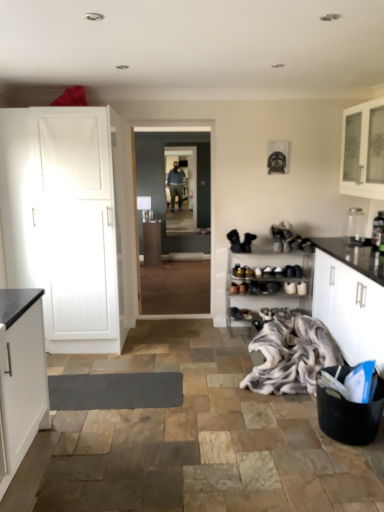
The height and width of the screenshot is (512, 384). Describe the element at coordinates (354, 227) in the screenshot. I see `clear glass jar at upper right, which is the 2th appliance from front to back` at that location.

The height and width of the screenshot is (512, 384). What are the coordinates of `clear glass jar at upper right, the 1th appliance from the back` in the screenshot? It's located at (354, 227).

Identify the location of fluffy white blanket at lower right. This screenshot has width=384, height=512. (291, 355).

The width and height of the screenshot is (384, 512). I want to click on black matte boot at center, the first footwear positioned from the top, so click(235, 241).

The height and width of the screenshot is (512, 384). What do you see at coordinates (363, 150) in the screenshot?
I see `white glass cabinet at upper right, which is counted as the 2th cabinetry, starting from the back` at bounding box center [363, 150].

Identify the location of wooden shoe rack at center. (266, 281).

This screenshot has width=384, height=512. Find the location of `clear glass jar at upper right, the 1th appliance from the back`. clear glass jar at upper right, the 1th appliance from the back is located at coordinates (354, 227).

Which is less distant, (350,135) or (149,245)?

The point (350,135) is in front.

Is white glass cabinet at upper right, which ranks as the first cabinetry in right-to-left order, to the right of matte wood cabinet at center, marked as the 1th cabinetry in a back-to-front arrangement, from the viewer's perspective?

Indeed, white glass cabinet at upper right, which ranks as the first cabinetry in right-to-left order, is positioned on the right side of matte wood cabinet at center, marked as the 1th cabinetry in a back-to-front arrangement.

Considering the relative positions of white glass cabinet at upper right, which is counted as the 2th cabinetry, starting from the back, and matte wood cabinet at center, which appears as the second cabinetry when viewed from the top, in the image provided, is white glass cabinet at upper right, which is counted as the 2th cabinetry, starting from the back, behind matte wood cabinet at center, which appears as the second cabinetry when viewed from the top,?

No, it is not.

Is white glass cabinet at upper right, marked as the 3th cabinetry in a bottom-to-top arrangement, turned away from matte wood cabinet at center, marked as the 1th cabinetry in a back-to-front arrangement?

No, matte wood cabinet at center, marked as the 1th cabinetry in a back-to-front arrangement, is not at the back of white glass cabinet at upper right, marked as the 3th cabinetry in a bottom-to-top arrangement.

Between point (247, 243) and point (196, 227), which one is positioned in front?

Point (247, 243)

Is black suede shoes at center, which ranks as the 2th footwear in top-to-bottom order, not within transparent glass door at center?

Absolutely, black suede shoes at center, which ranks as the 2th footwear in top-to-bottom order, is external to transparent glass door at center.

What are the coordinates of `footwear that is the 2nd one below the transparent glass door at center (from a real-world perspective)` in the screenshot? It's located at (247, 242).

How many degrees apart are the facing directions of black suede shoes at center, which ranks as the 2th footwear in top-to-bottom order, and transparent glass door at center?

0.218 degrees.

Is clear glass jar at upper right, the 1th appliance from the back, facing away from wooden shoe rack at center?

That's not correct — clear glass jar at upper right, the 1th appliance from the back, is not looking away from wooden shoe rack at center.

Considering the relative sizes of clear glass jar at upper right, which is the 2th appliance from front to back, and wooden shoe rack at center in the image provided, is clear glass jar at upper right, which is the 2th appliance from front to back, taller than wooden shoe rack at center?

Incorrect, the height of clear glass jar at upper right, which is the 2th appliance from front to back, is not larger of that of wooden shoe rack at center.

From the picture: How different are the orientations of clear glass jar at upper right, which is the 2th appliance from front to back, and wooden shoe rack at center in degrees?

They differ by 90.3 degrees in their facing directions.

This screenshot has width=384, height=512. I want to click on shelf behind the black woven basket at lower right, so click(266, 281).

Which is in front, point (335, 409) or point (255, 292)?

Positioned in front is point (335, 409).

Is black woven basket at lower right turned away from wooden shoe rack at center?

black woven basket at lower right is not turned away from wooden shoe rack at center.

From the image's perspective, is wooden shoe rack at center over matte wood cabinet at center, the 3th cabinetry viewed from the right?

No, from the image's perspective, wooden shoe rack at center is not on top of matte wood cabinet at center, the 3th cabinetry viewed from the right.

From a real-world perspective, who is located lower, wooden shoe rack at center or matte wood cabinet at center, the 3th cabinetry viewed from the right?

From a 3D spatial view, matte wood cabinet at center, the 3th cabinetry viewed from the right, is below.

Is wooden shoe rack at center positioned behind matte wood cabinet at center, marked as the 1th cabinetry in a back-to-front arrangement?

No, wooden shoe rack at center is closer to the viewer.

Which object is positioned more to the left, wooden shoe rack at center or matte wood cabinet at center, positioned as the 1th cabinetry in left-to-right order?

Positioned to the left is matte wood cabinet at center, positioned as the 1th cabinetry in left-to-right order.

Is black matte boot at center, the first footwear positioned from the top, not within black matte cabinet at right, which appears as the second cabinetry when viewed from the left?

Yes, black matte boot at center, the first footwear positioned from the top, is not within black matte cabinet at right, which appears as the second cabinetry when viewed from the left.

Considering the positions of objects black matte boot at center, the third footwear in the bottom-to-top sequence, and black matte cabinet at right, acting as the third cabinetry starting from the back, in the image provided, who is more to the left, black matte boot at center, the third footwear in the bottom-to-top sequence, or black matte cabinet at right, acting as the third cabinetry starting from the back,?

From the viewer's perspective, black matte boot at center, the third footwear in the bottom-to-top sequence, appears more on the left side.

Considering the sizes of objects black matte boot at center, the third footwear in the bottom-to-top sequence, and black matte cabinet at right, the 1th cabinetry viewed from the front, in the image provided, who is thinner, black matte boot at center, the third footwear in the bottom-to-top sequence, or black matte cabinet at right, the 1th cabinetry viewed from the front,?

black matte boot at center, the third footwear in the bottom-to-top sequence.

From a real-world perspective, who is located lower, black matte boot at center, the first footwear positioned from the top, or black matte cabinet at right, placed as the second cabinetry when sorted from right to left?

black matte cabinet at right, placed as the second cabinetry when sorted from right to left, from a real-world perspective.

Considering the points (259, 388) and (250, 267), which point is in front, point (259, 388) or point (250, 267)?

Positioned in front is point (259, 388).

Is fluffy white blanket at lower right wider or thinner than wooden shoe rack at center?

Considering their sizes, fluffy white blanket at lower right looks broader than wooden shoe rack at center.

Would you say fluffy white blanket at lower right is a long distance from wooden shoe rack at center?

No, fluffy white blanket at lower right is not far away from wooden shoe rack at center.

Which is more to the right, fluffy white blanket at lower right or wooden shoe rack at center?

From the viewer's perspective, fluffy white blanket at lower right appears more on the right side.

You are a GUI agent. You are given a task and a screenshot of the screen. Output one action in this format:
    pyautogui.click(x=<x>, y=<y>)
    Task: Click on the cabinetry located behind the white glass cabinet at upper right, marked as the 3th cabinetry in a bottom-to-top arrangement
    The height and width of the screenshot is (512, 384).
    Given the screenshot: What is the action you would take?
    pyautogui.click(x=152, y=242)

This screenshot has height=512, width=384. I want to click on glass door above the black suede shoes at center, which ranks as the 2th footwear in top-to-bottom order (from the image's perspective), so click(x=183, y=188).

When comparing their distances from white glass cabinet at upper right, marked as the 3th cabinetry in a bottom-to-top arrangement, does black suede shoes at center, which ranks as the 2th footwear in top-to-bottom order, or white matte cabinet at left seem further?

Among the two, white matte cabinet at left is located further to white glass cabinet at upper right, marked as the 3th cabinetry in a bottom-to-top arrangement.

From the image, which object appears to be farther from black woven basket at lower right, black matte boot at center, the first footwear positioned from the top, or wooden shoe rack at center?

black matte boot at center, the first footwear positioned from the top, is positioned further to the anchor black woven basket at lower right.

Based on their spatial positions, is white matte cabinet at left or black matte cabinet at right, which appears as the second cabinetry when viewed from the left, closer to black woven basket at lower right?

black matte cabinet at right, which appears as the second cabinetry when viewed from the left, is closer to black woven basket at lower right.

Estimate the real-world distances between objects in this image. Which object is closer to wooden shoe rack at center, fluffy white blanket at lower right or black suede shoes at center, marked as the second footwear in a bottom-to-top arrangement?

Among the two, black suede shoes at center, marked as the second footwear in a bottom-to-top arrangement, is located nearer to wooden shoe rack at center.

Estimate the real-world distances between objects in this image. Which object is closer to matte wood cabinet at center, the 2th cabinetry ordered from the bottom, black woven basket at lower right or transparent glass door at center?

transparent glass door at center is closer to matte wood cabinet at center, the 2th cabinetry ordered from the bottom.

Based on their spatial positions, is black matte cabinet at right, marked as the 1th cabinetry in a bottom-to-top arrangement, or fluffy white blanket at lower right further from matte wood cabinet at center, the 2th cabinetry ordered from the bottom?

The object further to matte wood cabinet at center, the 2th cabinetry ordered from the bottom, is black matte cabinet at right, marked as the 1th cabinetry in a bottom-to-top arrangement.

Which object lies nearer to the anchor point transparent glass door at center, white glass cabinet at upper right, which appears as the 3th cabinetry when viewed from the left, or white matte cabinet at left?

Based on the image, white matte cabinet at left appears to be nearer to transparent glass door at center.

When comparing their distances from white matte cabinet at left, does matte wood cabinet at center, which appears as the second cabinetry when viewed from the top, or black matte boot at center, the first footwear positioned from the top, seem further?

matte wood cabinet at center, which appears as the second cabinetry when viewed from the top, lies further to white matte cabinet at left than the other object.

Locate an element on the screen. The width and height of the screenshot is (384, 512). footwear positioned between black woven basket at lower right and black suede shoes at center, which ranks as the 2th footwear in top-to-bottom order, from near to far is located at coordinates (235, 241).

I want to click on shelf located between black matte boot at center, the first footwear positioned from the top, and metallic silver toaster at right, the second appliance in the back-to-front sequence, in the left-right direction, so click(x=266, y=281).

You are a GUI agent. You are given a task and a screenshot of the screen. Output one action in this format:
    pyautogui.click(x=<x>, y=<y>)
    Task: Click on the laundry located between black matte cabinet at right, marked as the 1th cabinetry in a bottom-to-top arrangement, and matte black shoe at center, which appears as the first footwear when ordered from the bottom, in the depth direction
    This screenshot has height=512, width=384.
    Given the screenshot: What is the action you would take?
    pyautogui.click(x=291, y=355)

Locate an element on the screen. The image size is (384, 512). footwear between white matte cabinet at left and matte black shoe at center, which appears as the first footwear when ordered from the bottom, from left to right is located at coordinates (235, 241).